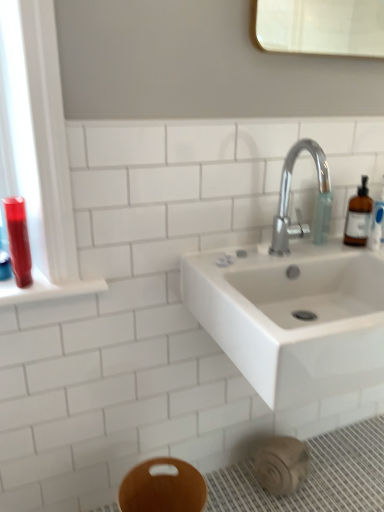
Locate an element on the screen. The height and width of the screenshot is (512, 384). polished chrome faucet at upper right is located at coordinates (298, 209).

Describe the element at coordinates (18, 240) in the screenshot. I see `shiny red plastic mouthwash at left` at that location.

Measure the distance between translucent amber bottle at right and camera.

They are 4.27 feet apart.

I want to click on translucent plastic soap dispenser at upper right, so click(x=322, y=217).

Identify the location of tap above the translucent amber bottle at right (from the image's perspective). Image resolution: width=384 pixels, height=512 pixels. (298, 209).

Which is in front, point (365, 223) or point (321, 211)?

Positioned in front is point (321, 211).

Considering the relative sizes of translucent amber bottle at right and polished chrome faucet at upper right in the image provided, is translucent amber bottle at right shorter than polished chrome faucet at upper right?

Yes, translucent amber bottle at right is shorter than polished chrome faucet at upper right.

Is translucent plastic soap dispenser at upper right to the left or to the right of polished chrome faucet at upper right in the image?

Based on their positions, translucent plastic soap dispenser at upper right is located to the right of polished chrome faucet at upper right.

Looking at their sizes, would you say translucent plastic soap dispenser at upper right is wider or thinner than polished chrome faucet at upper right?

Clearly, translucent plastic soap dispenser at upper right has less width compared to polished chrome faucet at upper right.

Which is in front, point (320, 209) or point (297, 146)?

Positioned in front is point (297, 146).

Is translucent plastic soap dispenser at upper right beside polished chrome faucet at upper right?

Indeed, translucent plastic soap dispenser at upper right and polished chrome faucet at upper right are beside each other and touching.

Between point (320, 202) and point (14, 223), which one is positioned behind?

Point (320, 202)

Locate an element on the screen. This screenshot has height=512, width=384. toiletry located on the right of shiny red plastic mouthwash at left is located at coordinates (322, 217).

Which of these two, translucent plastic soap dispenser at upper right or shiny red plastic mouthwash at left, is bigger?

shiny red plastic mouthwash at left.

Is translucent plastic soap dispenser at upper right not within shiny red plastic mouthwash at left?

Absolutely, translucent plastic soap dispenser at upper right is external to shiny red plastic mouthwash at left.

Is translucent plastic soap dispenser at upper right at the back of polished chrome faucet at upper right?

That's not correct — polished chrome faucet at upper right is not looking away from translucent plastic soap dispenser at upper right.

Considering the sizes of objects polished chrome faucet at upper right and translucent plastic soap dispenser at upper right in the image provided, who is smaller, polished chrome faucet at upper right or translucent plastic soap dispenser at upper right?

translucent plastic soap dispenser at upper right.

You are a GUI agent. You are given a task and a screenshot of the screen. Output one action in this format:
    pyautogui.click(x=<x>, y=<y>)
    Task: Click on the tap in front of the translucent plastic soap dispenser at upper right
    This screenshot has height=512, width=384.
    Given the screenshot: What is the action you would take?
    pyautogui.click(x=298, y=209)

From the image's perspective, which is above, polished chrome faucet at upper right or translucent plastic soap dispenser at upper right?

polished chrome faucet at upper right, from the image's perspective.

In the scene shown: Considering the relative positions of translucent plastic soap dispenser at upper right and wooden bidet at lower center in the image provided, is translucent plastic soap dispenser at upper right to the left or to the right of wooden bidet at lower center?

translucent plastic soap dispenser at upper right is to the right of wooden bidet at lower center.

Between point (319, 228) and point (149, 497), which one is positioned behind?

The point (319, 228) is farther.

From a real-world perspective, is translucent plastic soap dispenser at upper right positioned above or below wooden bidet at lower center?

translucent plastic soap dispenser at upper right is above wooden bidet at lower center.

Is polished chrome faucet at upper right positioned in front of wooden bidet at lower center?

No.

From the image's perspective, is polished chrome faucet at upper right located beneath wooden bidet at lower center?

No.

Between polished chrome faucet at upper right and wooden bidet at lower center, which one has smaller size?

With smaller size is polished chrome faucet at upper right.

From their relative heights in the image, would you say polished chrome faucet at upper right is taller or shorter than wooden bidet at lower center?

Clearly, polished chrome faucet at upper right is taller compared to wooden bidet at lower center.

Identify the location of soap dispenser lying on the right of wooden bidet at lower center. (358, 216).

Which is more distant, (159, 509) or (350, 241)?

The point (350, 241) is more distant.

From a real-world perspective, does wooden bidet at lower center stand above translucent amber bottle at right?

No.

Considering the positions of objects wooden bidet at lower center and translucent amber bottle at right in the image provided, who is more to the left, wooden bidet at lower center or translucent amber bottle at right?

Positioned to the left is wooden bidet at lower center.

Identify the location of tap located above the translucent amber bottle at right (from the image's perspective). This screenshot has height=512, width=384. (298, 209).

Image resolution: width=384 pixels, height=512 pixels. In order to click on toiletry that appears behind the polished chrome faucet at upper right in this screenshot , I will do `click(322, 217)`.

Based on their spatial positions, is wooden bidet at lower center or shiny red plastic mouthwash at left closer to translucent amber bottle at right?

wooden bidet at lower center is closer to translucent amber bottle at right.

Looking at the image, which one is located closer to translucent amber bottle at right, shiny red plastic mouthwash at left or translucent plastic soap dispenser at upper right?

translucent plastic soap dispenser at upper right.

Considering their positions, is translucent amber bottle at right positioned closer to polished chrome faucet at upper right than wooden bidet at lower center?

translucent amber bottle at right is positioned closer to the anchor polished chrome faucet at upper right.

Estimate the real-world distances between objects in this image. Which object is further from shiny red plastic mouthwash at left, wooden bidet at lower center or polished chrome faucet at upper right?

polished chrome faucet at upper right is further to shiny red plastic mouthwash at left.

Which object lies further to the anchor point translucent amber bottle at right, polished chrome faucet at upper right or shiny red plastic mouthwash at left?

Based on the image, shiny red plastic mouthwash at left appears to be further to translucent amber bottle at right.

From the image, which object appears to be nearer to polished chrome faucet at upper right, translucent plastic soap dispenser at upper right or shiny red plastic mouthwash at left?

translucent plastic soap dispenser at upper right lies closer to polished chrome faucet at upper right than the other object.

Which object lies further to the anchor point wooden bidet at lower center, shiny red plastic mouthwash at left or polished chrome faucet at upper right?

polished chrome faucet at upper right is positioned further to the anchor wooden bidet at lower center.

Which object lies nearer to the anchor point translucent plastic soap dispenser at upper right, shiny red plastic mouthwash at left or translucent amber bottle at right?

translucent amber bottle at right.

Locate an element on the screen. The image size is (384, 512). toiletry between translucent amber bottle at right and wooden bidet at lower center from top to bottom is located at coordinates (322, 217).

This screenshot has height=512, width=384. Identify the location of tap between shiny red plastic mouthwash at left and translucent amber bottle at right in the horizontal direction. pos(298,209).

This screenshot has height=512, width=384. Find the location of `bidet between shiny red plastic mouthwash at left and translucent amber bottle at right in the horizontal direction`. bidet between shiny red plastic mouthwash at left and translucent amber bottle at right in the horizontal direction is located at coordinates coord(162,487).

The height and width of the screenshot is (512, 384). Identify the location of mouthwash between translucent plastic soap dispenser at upper right and wooden bidet at lower center vertically. (18, 240).